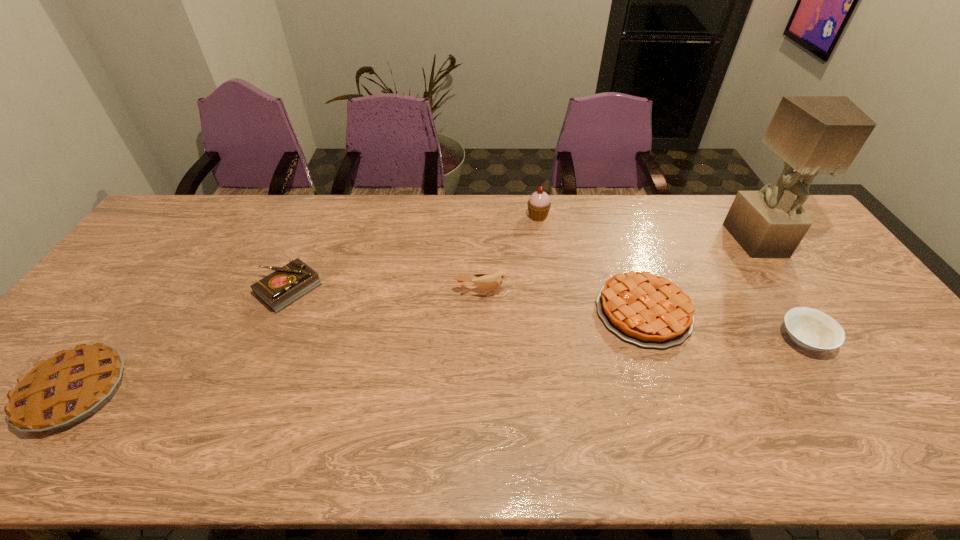
Where is `sculpture`? This screenshot has height=540, width=960. sculpture is located at coordinates (813, 134).

Locate an element on the screen. The width and height of the screenshot is (960, 540). the tallest object is located at coordinates (813, 134).

Image resolution: width=960 pixels, height=540 pixels. In order to click on the fourth object from left to right in this screenshot , I will do `click(539, 204)`.

Where is `cupcake`? This screenshot has height=540, width=960. cupcake is located at coordinates (539, 204).

What are the coordinates of `the fifth object from right to left` in the screenshot? It's located at (486, 282).

I want to click on bird, so click(486, 282).

What are the coordinates of `bowl` in the screenshot? It's located at (812, 329).

At what (x,y) coordinates should I click in order to perform the action: click on the second object from left to right. Please return your answer as a coordinate pair (x, y). Looking at the image, I should click on (287, 284).

Where is `the farther pie`? the farther pie is located at coordinates (640, 307).

Identify the location of the fifth object from left to right. Image resolution: width=960 pixels, height=540 pixels. (640, 307).